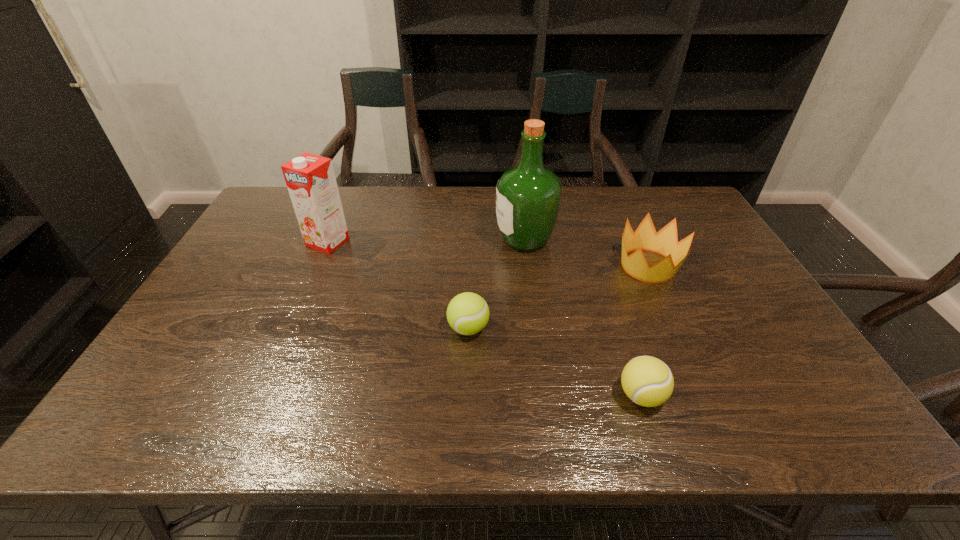
This screenshot has width=960, height=540. What are the coordinates of `vacant space located 0.360m on the front-facing side of the liquor` in the screenshot? It's located at (382, 240).

The height and width of the screenshot is (540, 960). In order to click on vacant space located 0.400m on the front-facing side of the liquor in this screenshot , I will do `click(370, 240)`.

This screenshot has height=540, width=960. I want to click on vacant space located on the back of the carton, so click(341, 212).

Identify the location of vacant space located 0.340m on the back of the crown. The image size is (960, 540). (614, 191).

Where is `free space located on the front of the farther tennis ball`? The width and height of the screenshot is (960, 540). free space located on the front of the farther tennis ball is located at coordinates (467, 405).

Locate an element on the screen. Image resolution: width=960 pixels, height=540 pixels. free space located 0.320m on the back of the right tennis ball is located at coordinates (605, 283).

This screenshot has width=960, height=540. Find the location of `object located at the near edge`. object located at the near edge is located at coordinates (647, 381).

Where is `vacant space at the far edge of the desktop`? This screenshot has width=960, height=540. vacant space at the far edge of the desktop is located at coordinates (486, 193).

This screenshot has height=540, width=960. Find the location of `blank area at the near edge`. blank area at the near edge is located at coordinates (598, 426).

What are the coordinates of `free spot at the left edge of the desktop` in the screenshot? It's located at (280, 227).